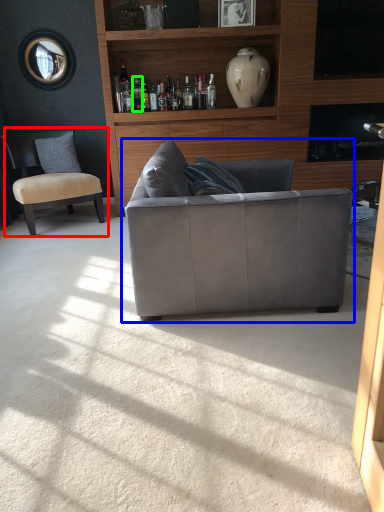
Question: Which is farther away from chair (highlighted by a red box)? studio couch (highlighted by a blue box) or bottle (highlighted by a green box)?

Choices:
 (A) studio couch
 (B) bottle

Answer: (A)